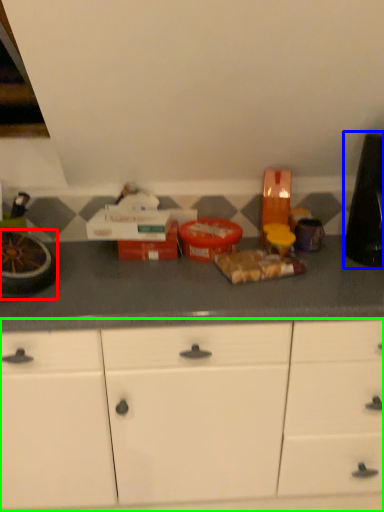
Question: Which is nearer to the appliance (highlighted by a red box)? appliance (highlighted by a blue box) or cabinetry (highlighted by a green box).

Choices:
 (A) appliance
 (B) cabinetry

Answer: (B)